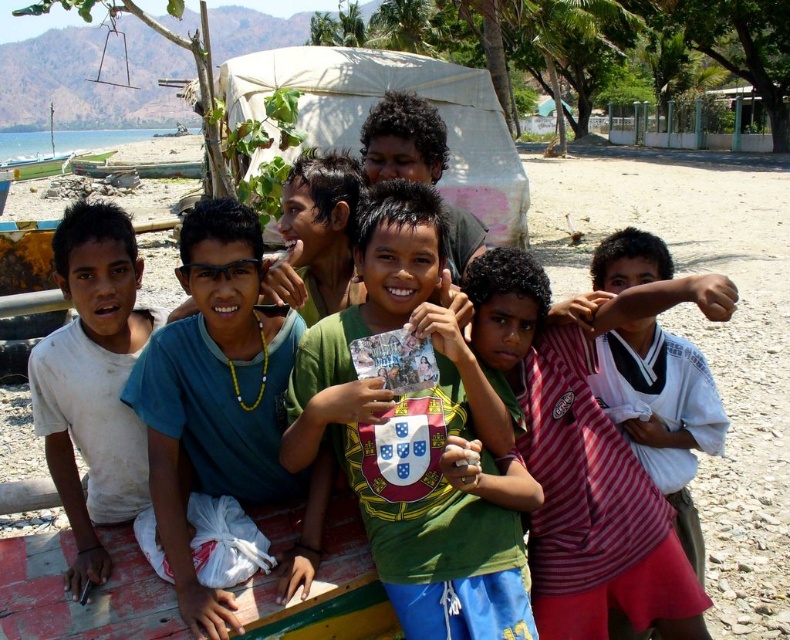
You are a photographer trying to capture a group photo of the children. You notice the blue fabric shirt at center and the white matte shirt at left. Which shirt should you focus on to ensure it stands out more in the photo due to its size?

The blue fabric shirt at center should be focused on because it is bigger than the white matte shirt at left, making it more noticeable in the photo.